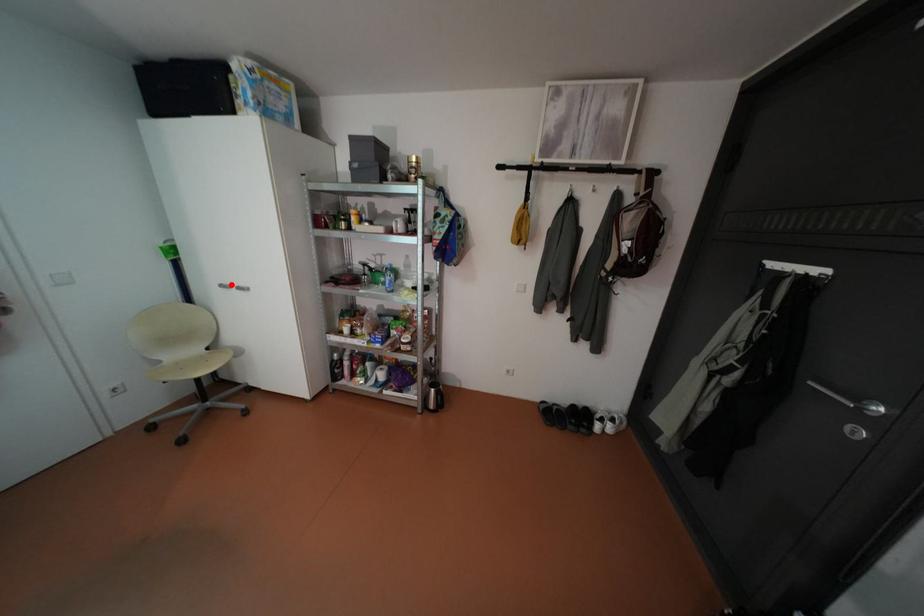
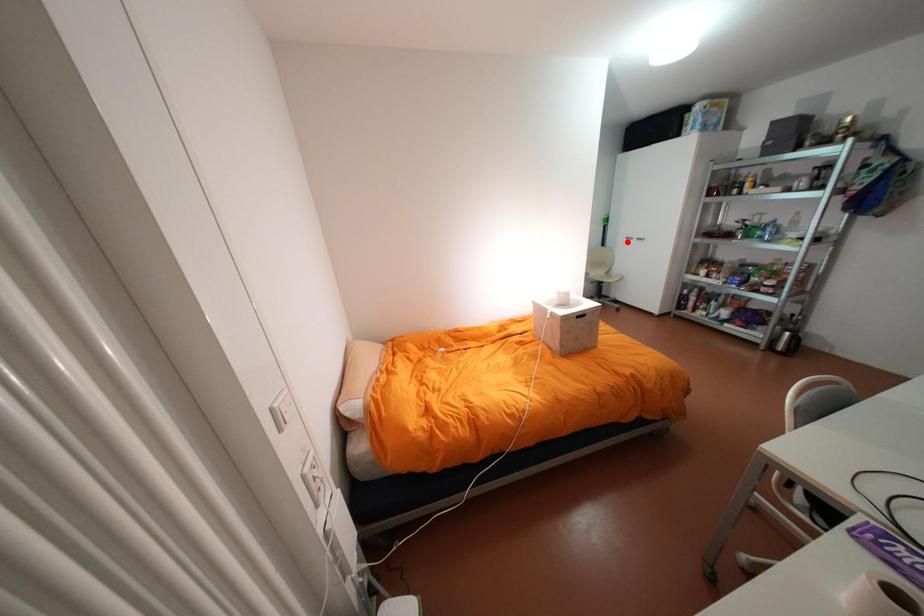
Looking at this image, I am providing you with two images of the same scene from different viewpoints. A red point is marked on the first image and another point is marked on the second image. Are the points marked in image1 and image2 representing the same 3D position?

No